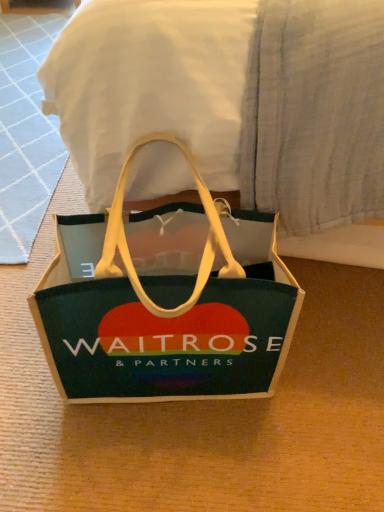
The image size is (384, 512). What do you see at coordinates (232, 99) in the screenshot?
I see `white fabric at center` at bounding box center [232, 99].

Identify the location of white fabric at center. (232, 99).

You are a GUI agent. You are given a task and a screenshot of the screen. Output one action in this format:
    pyautogui.click(x=<x>, y=<y>)
    Task: Click on the green felt bag at center
    This screenshot has height=512, width=384.
    Given the screenshot: What is the action you would take?
    pyautogui.click(x=166, y=302)

Describe the element at coordinates (166, 302) in the screenshot. This screenshot has height=512, width=384. I see `green felt bag at center` at that location.

Image resolution: width=384 pixels, height=512 pixels. In order to click on white fabric at center in this screenshot , I will do `click(232, 99)`.

Between white fabric at center and green felt bag at center, which one appears on the right side from the viewer's perspective?

white fabric at center.

Considering their positions, is white fabric at center located in front of or behind green felt bag at center?

In the image, white fabric at center appears in front of green felt bag at center.

Considering the positions of point (271, 188) and point (206, 365), is point (271, 188) closer or farther from the camera than point (206, 365)?

Point (271, 188) is closer to the camera than point (206, 365).

From the image's perspective, between white fabric at center and green felt bag at center, who is located below?

green felt bag at center is shown below in the image.

From a real-world perspective, which object stands above the other?

From a 3D spatial view, white fabric at center is above.

Is white fabric at center wider or thinner than green felt bag at center?

In the image, white fabric at center appears to be wider than green felt bag at center.

Can you confirm if white fabric at center is shorter than green felt bag at center?

Incorrect, the height of white fabric at center does not fall short of that of green felt bag at center.

Which of these two, white fabric at center or green felt bag at center, is bigger?

white fabric at center is bigger.

Is white fabric at center positioned beyond the bounds of green felt bag at center?

Yes, white fabric at center is not within green felt bag at center.

Would you say white fabric at center is a long distance from green felt bag at center?

No, white fabric at center is not far away from green felt bag at center.

Is white fabric at center facing away from green felt bag at center?

white fabric at center is not turned away from green felt bag at center.

Where is `handbag behind the white fabric at center`? handbag behind the white fabric at center is located at coordinates (166, 302).

Based on their positions, is green felt bag at center located to the left or right of white fabric at center?

green felt bag at center is positioned on white fabric at center's left side.

Based on the photo, does green felt bag at center come in front of white fabric at center?

No, green felt bag at center is behind white fabric at center.

Considering the positions of points (202, 339) and (332, 153), is point (202, 339) closer to camera compared to point (332, 153)?

No, it is not.

From the image's perspective, is green felt bag at center positioned above or below white fabric at center?

green felt bag at center is below white fabric at center.

From a real-world perspective, which object rests below the other?

green felt bag at center.

Can you confirm if green felt bag at center is wider than white fabric at center?

No, green felt bag at center is not wider than white fabric at center.

Considering the relative sizes of green felt bag at center and white fabric at center in the image provided, is green felt bag at center shorter than white fabric at center?

Yes, green felt bag at center is shorter than white fabric at center.

Considering the relative sizes of green felt bag at center and white fabric at center in the image provided, is green felt bag at center smaller than white fabric at center?

Yes.

Do you think green felt bag at center is within white fabric at center, or outside of it?

green felt bag at center is spatially situated outside white fabric at center.

Can you see green felt bag at center touching white fabric at center?

No, green felt bag at center is not in contact with white fabric at center.

Is green felt bag at center positioned with its back to white fabric at center?

No, white fabric at center is not at the back of green felt bag at center.

Identify the location of handbag that appears below the white fabric at center (from a real-world perspective). (166, 302).

At what (x,y) coordinates should I click in order to perform the action: click on handbag on the left of the white fabric at center. Please return your answer as a coordinate pair (x, y). This screenshot has width=384, height=512. Looking at the image, I should click on (166, 302).

Where is `bedding in front of the green felt bag at center`? The image size is (384, 512). bedding in front of the green felt bag at center is located at coordinates (232, 99).